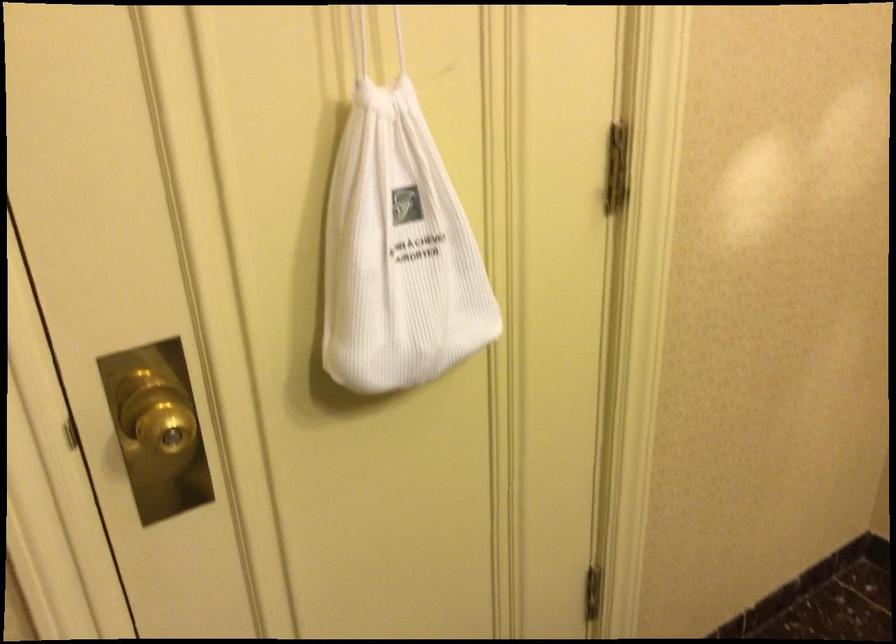
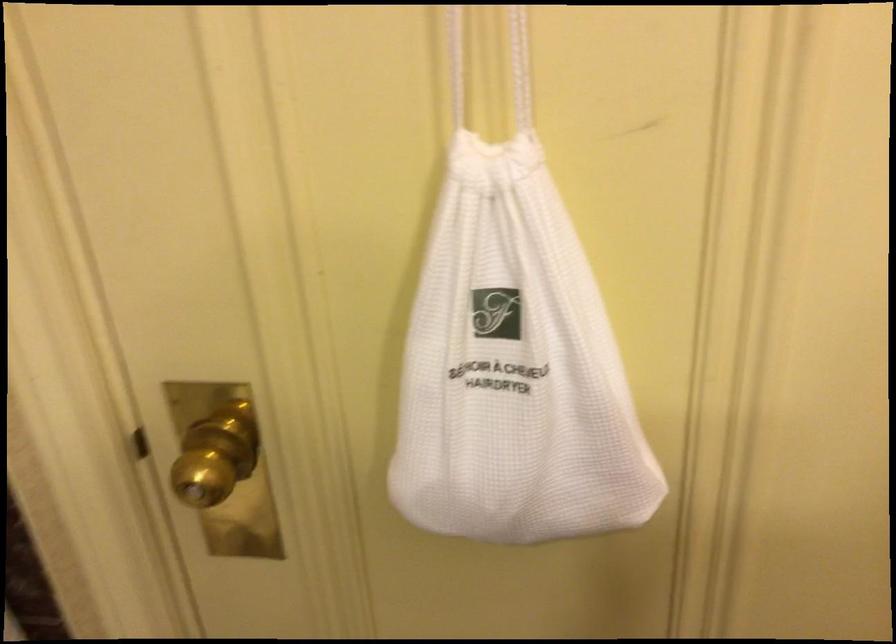
Find the pixel in the second image that matches (x=398, y=254) in the first image.

(513, 368)